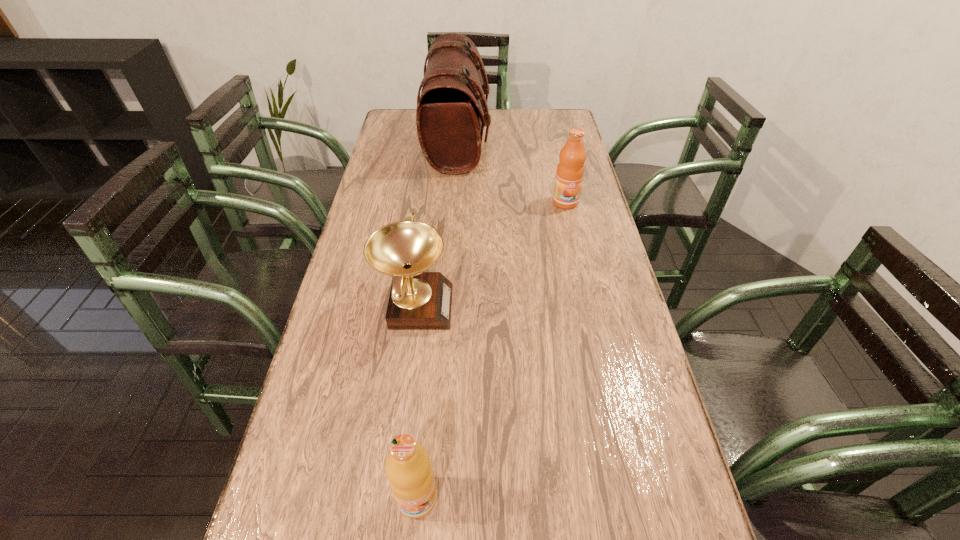
Locate an element on the screen. The image size is (960, 540). object located at the far edge is located at coordinates (450, 122).

Find the location of a particular element. This screenshot has width=960, height=540. object positioned at the left edge is located at coordinates (419, 300).

At what (x,y) coordinates should I click in order to perform the action: click on object at the right edge. Please return your answer as a coordinate pair (x, y). This screenshot has height=540, width=960. Looking at the image, I should click on tap(569, 175).

In the image, there is a desktop. Find the location of `vacant area at the far edge`. vacant area at the far edge is located at coordinates (520, 132).

Where is `vacant position at the left edge of the desktop`? The width and height of the screenshot is (960, 540). vacant position at the left edge of the desktop is located at coordinates (353, 464).

Locate an element on the screen. The image size is (960, 540). free region at the right edge of the desktop is located at coordinates (586, 179).

The height and width of the screenshot is (540, 960). Find the location of `vacant space at the far left corner of the desktop`. vacant space at the far left corner of the desktop is located at coordinates (409, 110).

Image resolution: width=960 pixels, height=540 pixels. I want to click on vacant area that lies between the satchel and the award, so click(437, 224).

Where is `free area in between the tallest object and the farther fruit juice`? The height and width of the screenshot is (540, 960). free area in between the tallest object and the farther fruit juice is located at coordinates (512, 172).

Where is `blank region between the third farthest object and the tallest object`? The image size is (960, 540). blank region between the third farthest object and the tallest object is located at coordinates pyautogui.click(x=437, y=224).